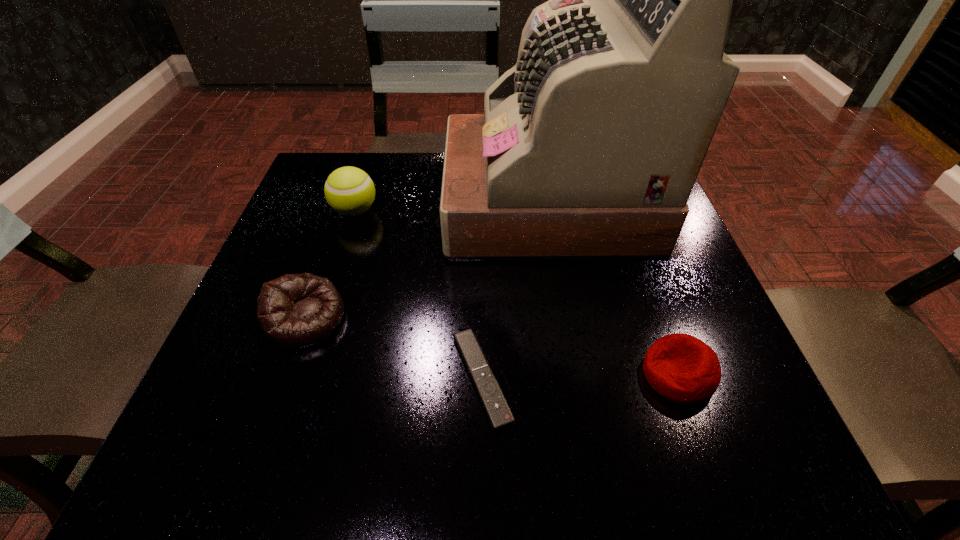
Where is `beanbag that is at the right edge`? Image resolution: width=960 pixels, height=540 pixels. beanbag that is at the right edge is located at coordinates 682,368.

Find the location of a particular element. Image resolution: width=960 pixels, height=540 pixels. object that is at the far left corner is located at coordinates (349, 191).

This screenshot has width=960, height=540. Identify the location of object located in the far right corner section of the desktop. pyautogui.click(x=589, y=147).

This screenshot has width=960, height=540. In the image, there is a desktop. Find the location of `blank space at the near edge`. blank space at the near edge is located at coordinates (451, 429).

Where is `vacant area at the left edge of the desktop`? vacant area at the left edge of the desktop is located at coordinates pyautogui.click(x=332, y=221).

This screenshot has width=960, height=540. In the image, there is a desktop. Find the location of `vacant space at the right edge`. vacant space at the right edge is located at coordinates [618, 290].

In the image, there is a desktop. At what (x,y) coordinates should I click in order to perform the action: click on blank space at the far left corner. Please return your answer as a coordinate pair (x, y). This screenshot has width=960, height=540. Looking at the image, I should click on (366, 158).

Where is `free space at the near right corner of the desktop`? The image size is (960, 540). free space at the near right corner of the desktop is located at coordinates (757, 468).

Find the location of a particular element. vacant area between the left beanbag and the second tallest object is located at coordinates (330, 265).

Find the location of a particular element. The height and width of the screenshot is (540, 960). free space between the left beanbag and the tallest object is located at coordinates (426, 260).